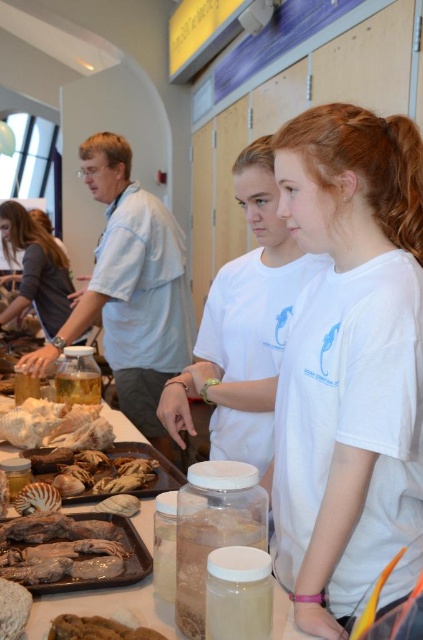
You are a visitor at this educational exhibit and want to take a photo of the brown matte duck at lower left without the brown crumbly bread at lower left appearing in the frame. How should you position your camera?

Move the camera so that it is positioned in front of the brown matte duck at lower left, ensuring the brown crumbly bread at lower left is out of view behind it.